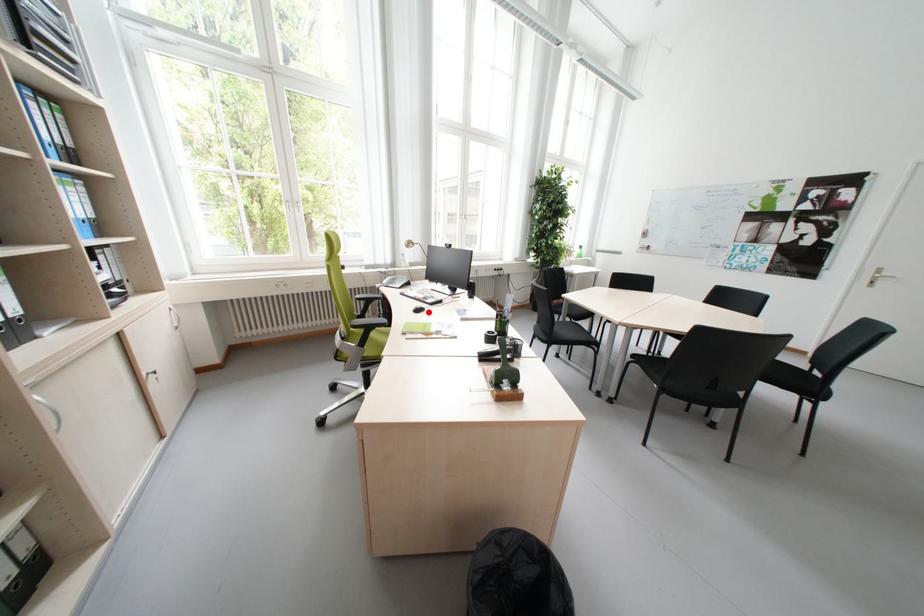
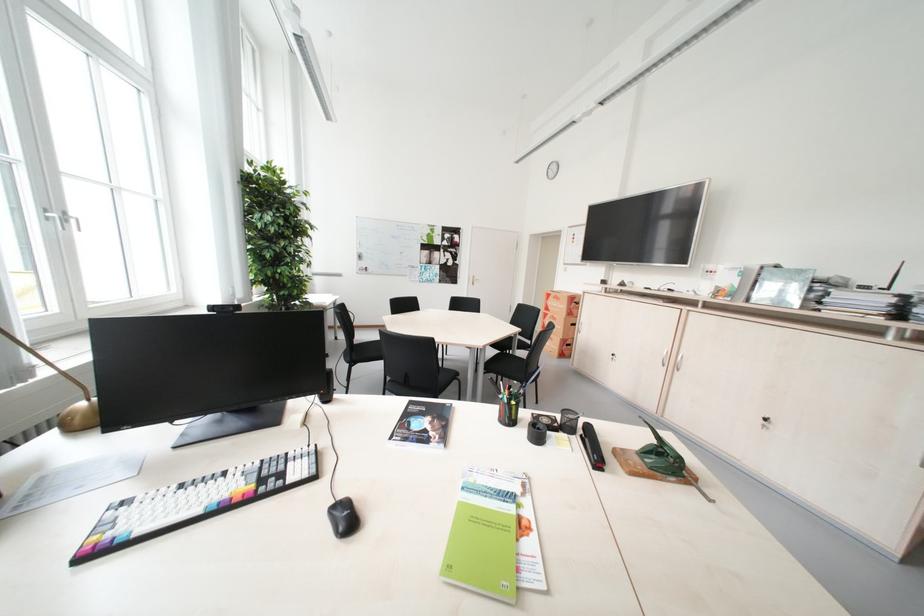
Where in the second image is the point corresponding to the highlighted location from the first image?

(359, 521)